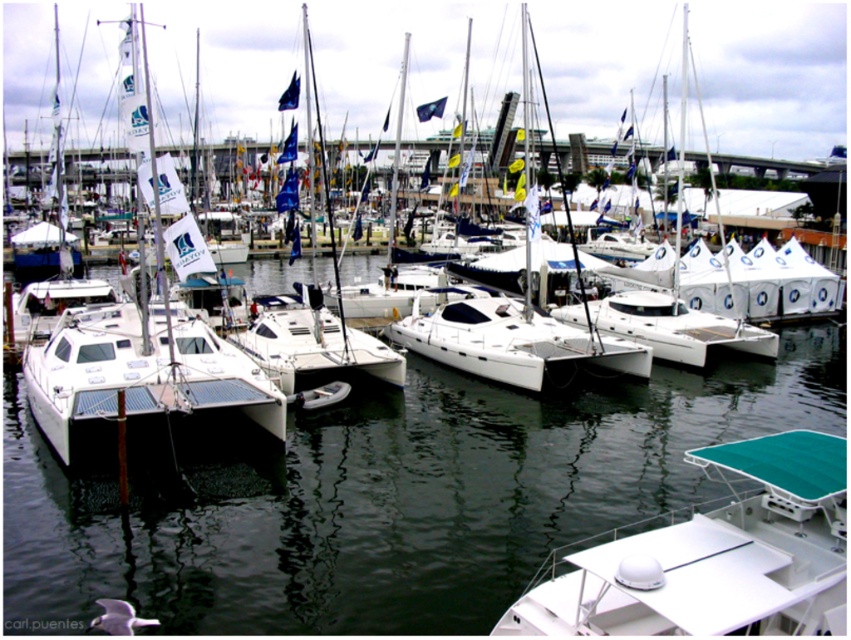
You are a photographer trying to capture the reflection of the white glossy water at center and the white matte catamaran at center. Which object will have a clearer reflection in the water?

The white glossy water at center has a greater height compared to the white matte catamaran at center, so the reflection of the white glossy water at center will be clearer.

You are standing at the marina and want to reach a specific point marked as point (x=831, y=564). If your average walking speed is 1.5 meters per second, how many seconds will it take you to reach that point?

The distance between you and point (x=831, y=564) is 6.69 meters. At a speed of 1.5 meters per second, it would take approximately 4.46 seconds to reach the point.